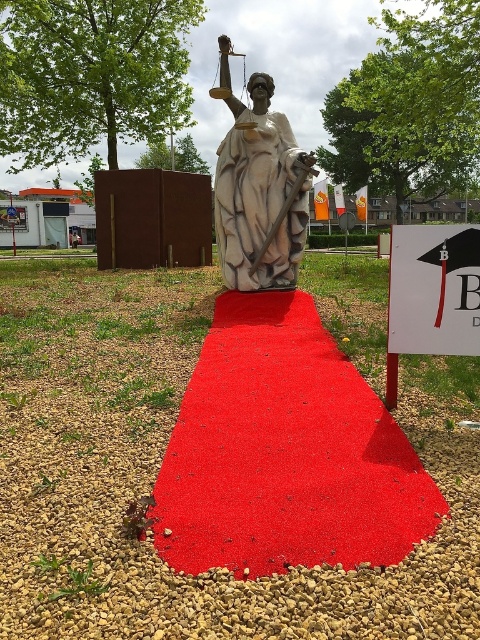
Question: Where is white marble statue at center located in relation to white paper sign at center in the image?

Choices:
 (A) above
 (B) below

Answer: (A)

Question: Which point is closer to the camera?

Choices:
 (A) (228, 84)
 (B) (408, 276)
 (C) (403, 496)

Answer: (C)

Question: Estimate the real-world distances between objects in this image. Which object is farther from the white paper sign at center?

Choices:
 (A) red carpet at center
 (B) white marble statue at center

Answer: (B)

Question: Can you confirm if white marble statue at center is positioned to the right of white paper sign at center?

Choices:
 (A) yes
 (B) no

Answer: (B)

Question: Is red carpet at center positioned behind white marble statue at center?

Choices:
 (A) yes
 (B) no

Answer: (B)

Question: Which point is closer to the camera?

Choices:
 (A) red carpet at center
 (B) white marble statue at center

Answer: (A)